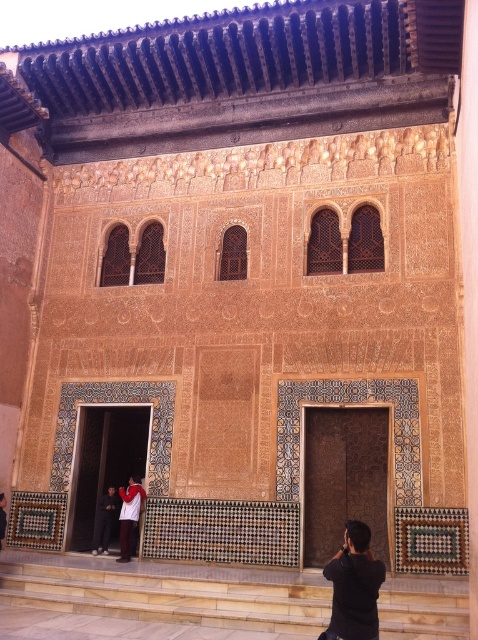
Can you confirm if black matte shirt at lower right is shorter than white cotton shirt at center?

In fact, black matte shirt at lower right may be taller than white cotton shirt at center.

Does black matte shirt at lower right have a smaller size compared to white cotton shirt at center?

Incorrect, black matte shirt at lower right is not smaller in size than white cotton shirt at center.

Is point (352, 564) positioned behind point (125, 540)?

No.

Locate an element on the screen. black matte shirt at lower right is located at coordinates (354, 586).

The height and width of the screenshot is (640, 478). Describe the element at coordinates (167, 592) in the screenshot. I see `light beige stone stairs at lower center` at that location.

Is point (214, 577) in front of point (134, 522)?

Yes, point (214, 577) is in front of point (134, 522).

The height and width of the screenshot is (640, 478). In order to click on light beige stone stairs at lower center in this screenshot , I will do tap(167, 592).

Who is more forward, (x=130, y=506) or (x=96, y=531)?

Positioned in front is point (x=130, y=506).

Is white cotton shirt at center to the right of dark gray fabric pants at lower left from the viewer's perspective?

Correct, you'll find white cotton shirt at center to the right of dark gray fabric pants at lower left.

Which is behind, point (119, 524) or point (111, 500)?

Positioned behind is point (119, 524).

I want to click on white cotton shirt at center, so click(x=129, y=515).